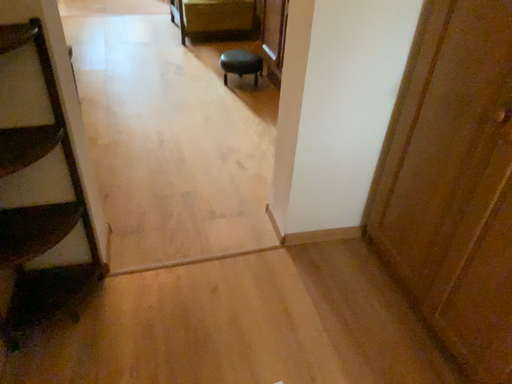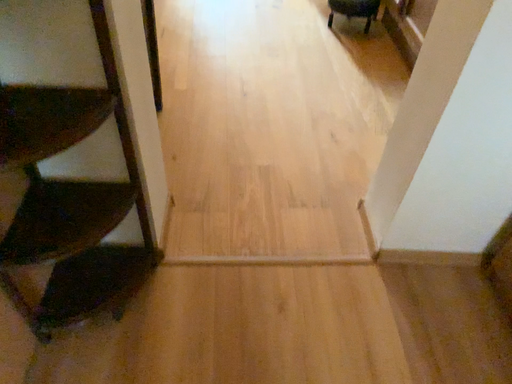
Question: Which way did the camera rotate in the video?

Choices:
 (A) rotated upward
 (B) rotated downward

Answer: (B)